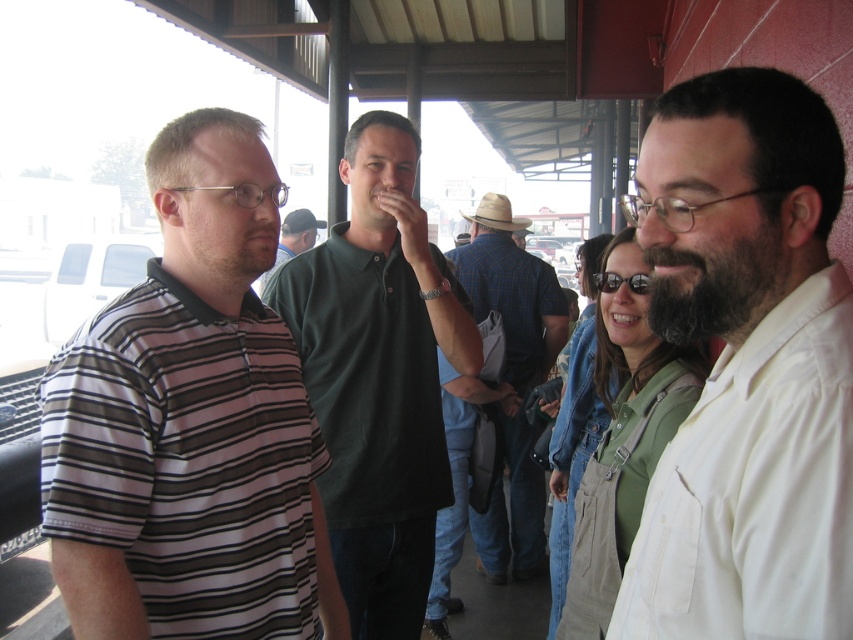
You are trying to decide which person to approach for directions. The white cotton shirt at center and the denim overalls at center are both in your line of sight. Which one appears shorter?

The white cotton shirt at center is not as tall as denim overalls at center, so the person wearing the white cotton shirt at center appears shorter.

You are a photographer trying to capture a group photo of the white cotton shirt at center and the green denim overalls at center. Based on their heights, which one should you position closer to the camera to ensure both are visible in the frame?

The white cotton shirt at center is not as tall as the green denim overalls at center, so you should position the white cotton shirt at center closer to the camera to ensure both are visible in the frame.